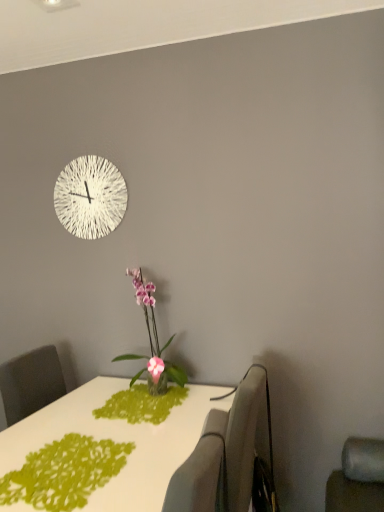
Question: Is white glossy table at center completely or partially inside white textured clock at upper center?

Choices:
 (A) yes
 (B) no

Answer: (B)

Question: Is white textured clock at upper center to the left of white glossy table at center from the viewer's perspective?

Choices:
 (A) yes
 (B) no

Answer: (A)

Question: Considering the relative sizes of white textured clock at upper center and white glossy table at center in the image provided, is white textured clock at upper center wider than white glossy table at center?

Choices:
 (A) no
 (B) yes

Answer: (A)

Question: Considering the relative sizes of white textured clock at upper center and white glossy table at center in the image provided, is white textured clock at upper center bigger than white glossy table at center?

Choices:
 (A) no
 (B) yes

Answer: (A)

Question: Is white textured clock at upper center smaller than white glossy table at center?

Choices:
 (A) no
 (B) yes

Answer: (B)

Question: Visually, is pink glossy orchid at center positioned to the left or to the right of white glossy table at center?

Choices:
 (A) right
 (B) left

Answer: (A)

Question: Considering their positions, is pink glossy orchid at center located in front of or behind white glossy table at center?

Choices:
 (A) behind
 (B) front

Answer: (A)

Question: Based on their sizes in the image, would you say pink glossy orchid at center is bigger or smaller than white glossy table at center?

Choices:
 (A) small
 (B) big

Answer: (A)

Question: Does point (150, 317) appear closer or farther from the camera than point (31, 430)?

Choices:
 (A) closer
 (B) farther

Answer: (B)

Question: Considering the positions of point (139, 480) and point (130, 382), is point (139, 480) closer or farther from the camera than point (130, 382)?

Choices:
 (A) closer
 (B) farther

Answer: (A)

Question: Would you say white glossy table at center is to the left or to the right of pink glossy orchid at center in the picture?

Choices:
 (A) left
 (B) right

Answer: (A)

Question: In the image, is white glossy table at center positioned in front of or behind pink glossy orchid at center?

Choices:
 (A) behind
 (B) front

Answer: (B)

Question: From a real-world perspective, is white glossy table at center above or below pink glossy orchid at center?

Choices:
 (A) below
 (B) above

Answer: (A)

Question: From the image's perspective, is gray fabric swivel chair at right, placed as the 1th swivel chair when sorted from back to front, above or below pink glossy orchid at center?

Choices:
 (A) above
 (B) below

Answer: (B)

Question: Considering the positions of gray fabric swivel chair at right, acting as the second swivel chair starting from the front, and pink glossy orchid at center in the image, is gray fabric swivel chair at right, acting as the second swivel chair starting from the front, bigger or smaller than pink glossy orchid at center?

Choices:
 (A) small
 (B) big

Answer: (A)